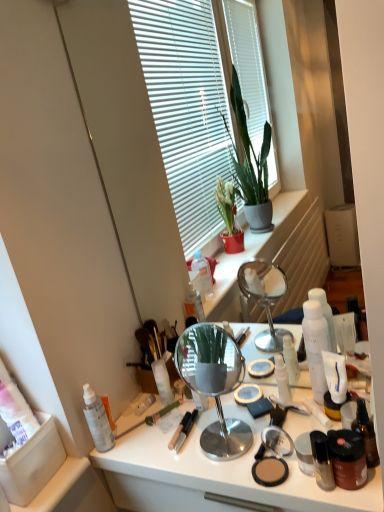
You are a GUI agent. You are given a task and a screenshot of the screen. Output one action in this format:
    pyautogui.click(x=<x>, y=<y>)
    Task: Click on the empty space that is in between transparent plastic spray bottle at left, the 1th toiletry in the left-to-right sequence, and shiny brown bottle at right, which is the first toiletry from right to left
    
    Given the screenshot: What is the action you would take?
    pyautogui.click(x=183, y=452)